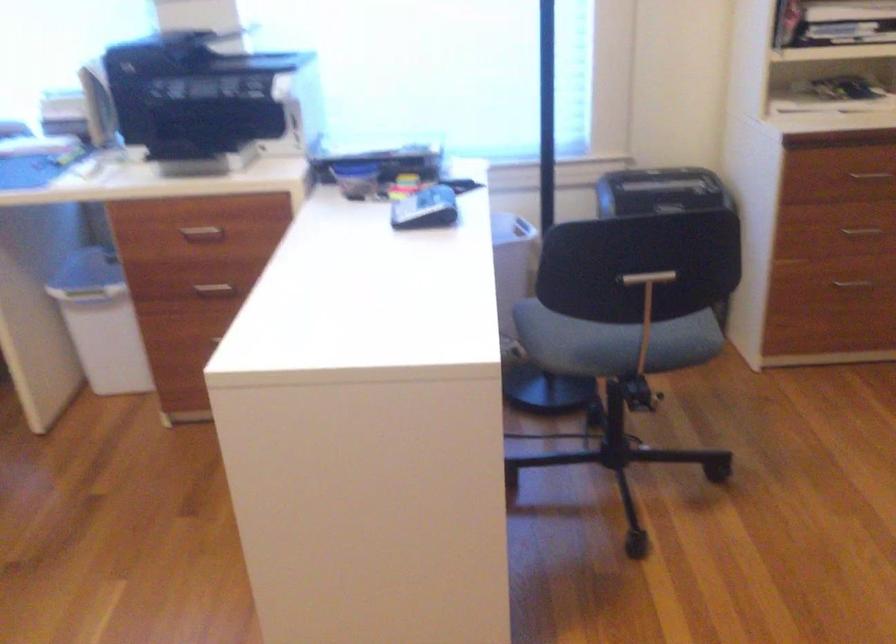
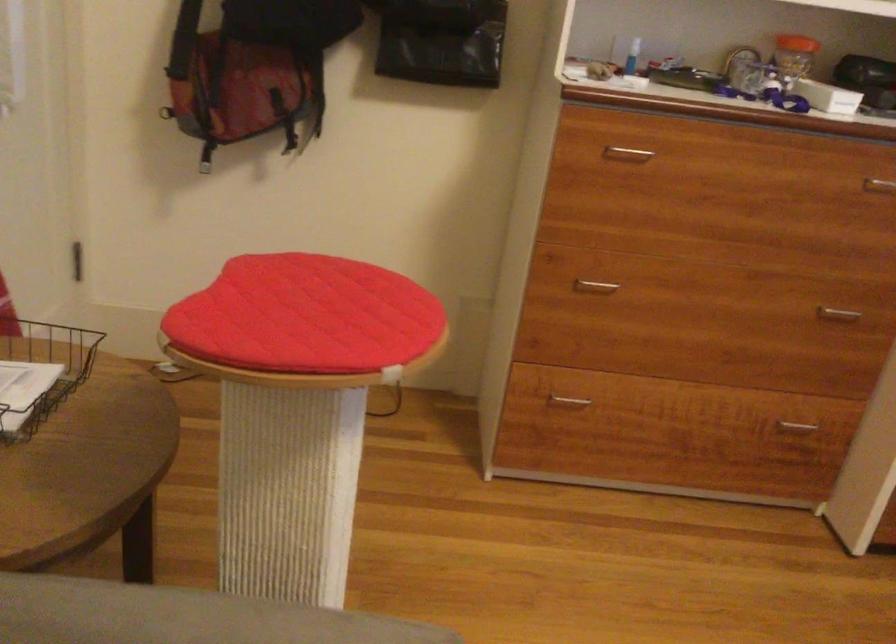
Consider the image. The first image is from the beginning of the video and the second image is from the end. How did the camera likely rotate when shooting the video?

The camera rotated toward left-down.